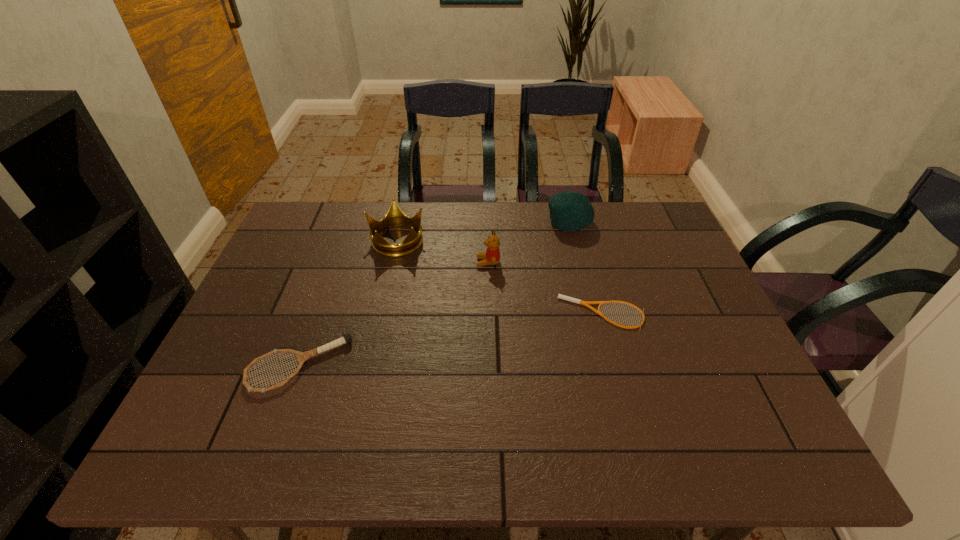
Where is `beanie`? beanie is located at coordinates (569, 211).

The width and height of the screenshot is (960, 540). What are the coordinates of `teddy bear` in the screenshot? It's located at (492, 256).

Locate an element on the screen. Image resolution: width=960 pixels, height=540 pixels. crown is located at coordinates (395, 217).

Locate an element on the screen. This screenshot has width=960, height=540. the fourth tallest object is located at coordinates (302, 356).

Where is `the nearer tennis racket`? The height and width of the screenshot is (540, 960). the nearer tennis racket is located at coordinates (302, 356).

This screenshot has width=960, height=540. Find the location of `the shorter tennis racket`. the shorter tennis racket is located at coordinates (585, 303).

This screenshot has width=960, height=540. In order to click on the shortest object in this screenshot , I will do `click(585, 303)`.

Where is `vacant space located 0.230m on the left of the beanie`? Image resolution: width=960 pixels, height=540 pixels. vacant space located 0.230m on the left of the beanie is located at coordinates (477, 222).

Where is `free point located 0.380m on the front-facing side of the teddy bear`? Image resolution: width=960 pixels, height=540 pixels. free point located 0.380m on the front-facing side of the teddy bear is located at coordinates (349, 262).

Locate an element on the screen. The width and height of the screenshot is (960, 540). blank space located 0.310m on the front-facing side of the teddy bear is located at coordinates (372, 262).